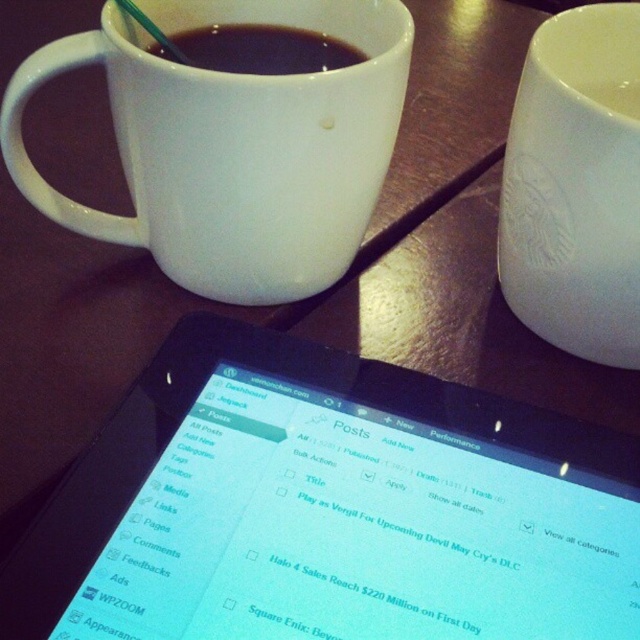
You are a graphic designer working on a project and need to place a new logo exactly at the point with coordinates (328, 508) on the tablet screen. According to the scene, where should you position the logo on the tablet?

The point (328, 508) corresponds to the black glossy tablet at center, so you should place the logo at the center of the tablet screen.

You are organizing items on a wooden table and need to place a new item between the black glossy tablet at center and the white glossy mug at upper center. Based on their sizes, which item should you move to make more space?

Since the black glossy tablet at center occupies less space than the white glossy mug at upper center, you should move the white glossy mug at upper center to create more space for the new item.

You are a barista preparing drinks for customers. You have two cups on the table, the white glossy mug at upper center and the matte white cup at upper center. Which cup is placed below the other?

The white glossy mug at upper center is positioned under the matte white cup at upper center, so the glossy mug is below the matte cup.